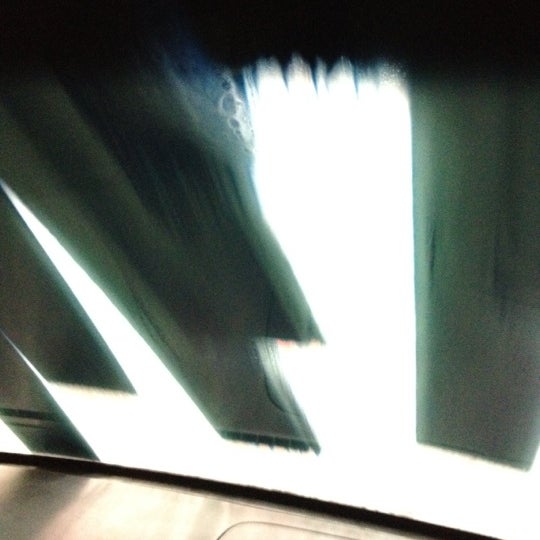
Locate an element on the screen. This screenshot has height=540, width=540. very bright lights is located at coordinates (372, 245), (157, 416), (8, 441), (487, 485).